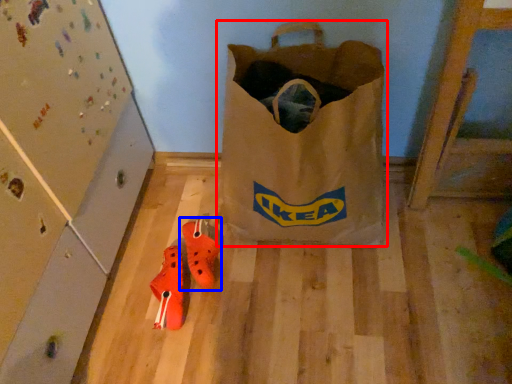
Question: Which object is closer to the camera taking this photo, luggage and bags (highlighted by a red box) or footwear (highlighted by a blue box)?

Choices:
 (A) luggage and bags
 (B) footwear

Answer: (A)